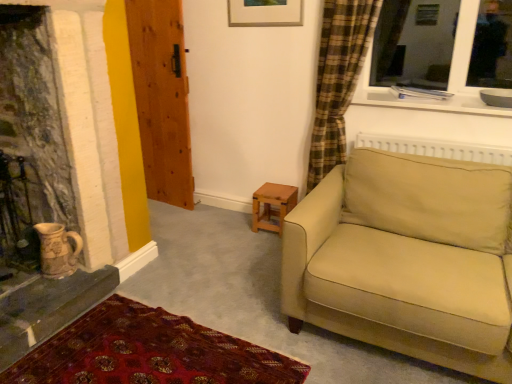
Identify the location of free point to the left of beige fabric couch at right. (225, 275).